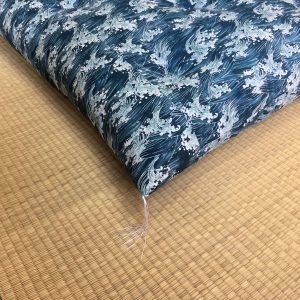
Image resolution: width=300 pixels, height=300 pixels. I want to click on wicker table runner, so click(x=201, y=267).